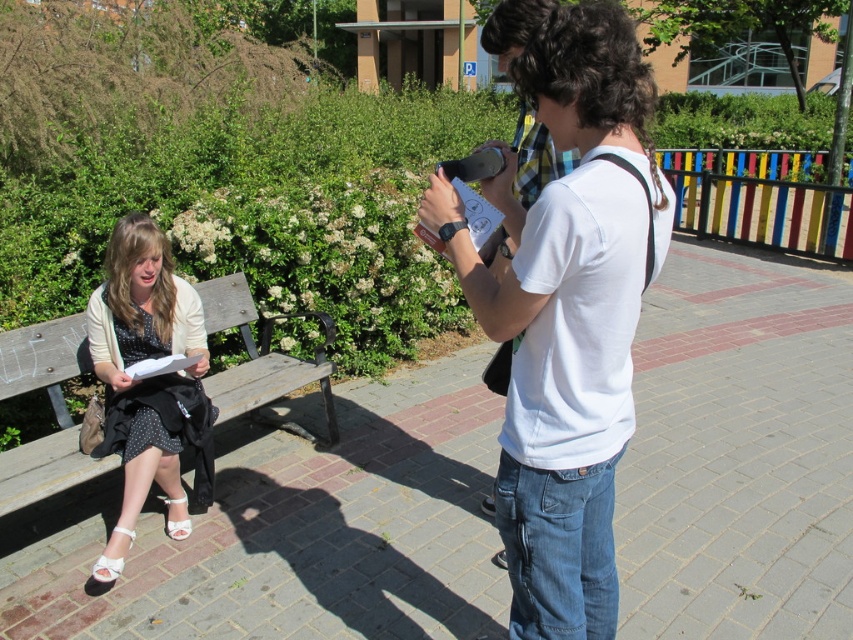
Question: Is matte white blouse at left wider than wooden bench at left?

Choices:
 (A) no
 (B) yes

Answer: (A)

Question: Which object is the closest to the matte white blouse at left?

Choices:
 (A) white cotton t-shirt at center
 (B) wooden bench at left
 (C) white cotton shirt at center

Answer: (B)

Question: Which object appears closest to the camera in this image?

Choices:
 (A) matte white blouse at left
 (B) white cotton t-shirt at center

Answer: (B)

Question: Is wooden bench at left wider than white cotton t-shirt at center?

Choices:
 (A) no
 (B) yes

Answer: (B)

Question: Which point appears closest to the camera in this image?

Choices:
 (A) (520, 13)
 (B) (115, 390)
 (C) (85, 349)
 (D) (514, 282)

Answer: (D)

Question: Is white cotton shirt at center to the right of matte white blouse at left from the viewer's perspective?

Choices:
 (A) yes
 (B) no

Answer: (A)